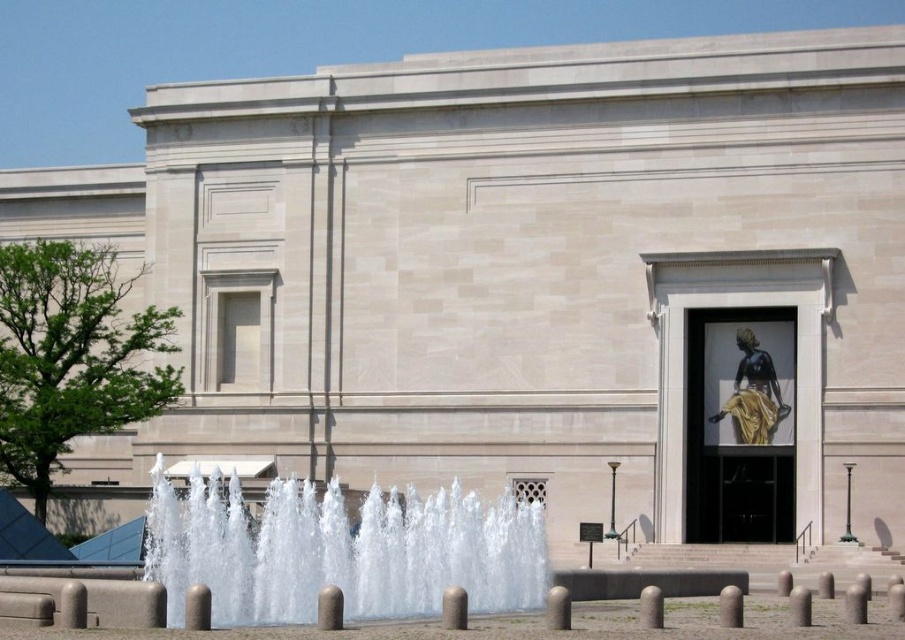
Question: Where is clear water at center located in relation to smooth concrete bollard at lower center in the image?

Choices:
 (A) below
 (B) above

Answer: (A)

Question: Which object is closer to the camera taking this photo?

Choices:
 (A) smooth concrete bollard at lower center
 (B) black polished statue at center

Answer: (A)

Question: Can you confirm if black polished statue at center is smaller than smooth concrete bollard at lower center?

Choices:
 (A) no
 (B) yes

Answer: (A)

Question: Among these points, which one is farthest from the camera?

Choices:
 (A) (779, 394)
 (B) (555, 593)

Answer: (A)

Question: Which point is closer to the camera?

Choices:
 (A) black polished statue at center
 (B) smooth concrete bollard at lower center
 (C) clear water at center

Answer: (B)

Question: Does clear water at center have a lesser width compared to black polished statue at center?

Choices:
 (A) yes
 (B) no

Answer: (B)